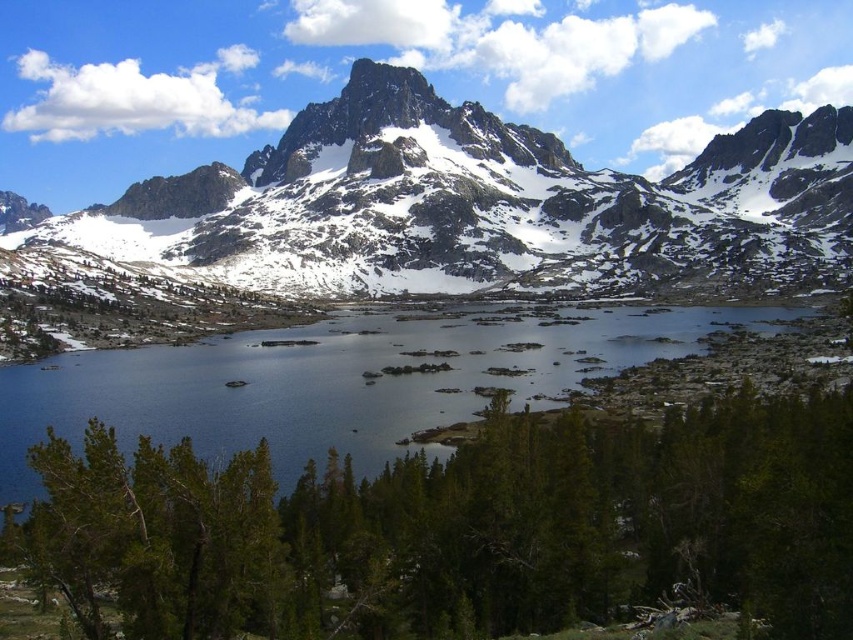
Based on the scene description, which object is located lower in the image between the snowy granite mountain range at upper center and the snowy granite peak at upper center?

The snowy granite mountain range at upper center is positioned lower than the snowy granite peak at upper center, so it is located lower in the image.

You are a photographer planning to capture the snowy granite mountain range at upper center and the clear water at center in a single shot. Based on the scene, which object should appear larger in your photograph?

Result: The snowy granite mountain range at upper center should appear larger in the photograph because it has a greater height compared to the clear water at center.

You are an environmental scientist assessing the landscape. You need to determine which object occupies a larger area in the image. Based on the scene, which is bigger between the clear water at center and the snowy granite peak at upper center?

The snowy granite peak at upper center is larger than the clear water at center according to the description.